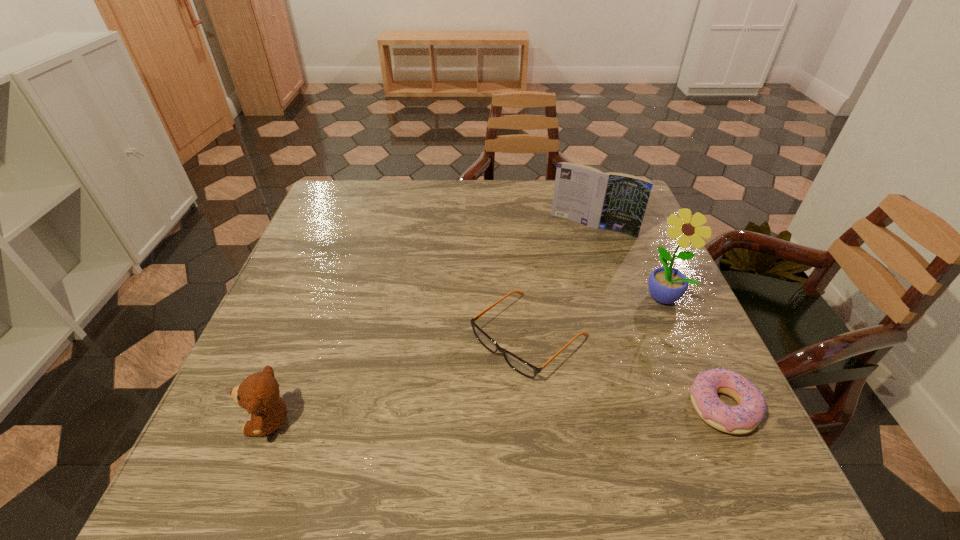
I want to click on vacant area at the left edge of the desktop, so click(x=331, y=340).

This screenshot has height=540, width=960. In the image, there is a desktop. Identify the location of free space at the right edge. (688, 337).

Where is `blank space at the far left corner of the desktop`? Image resolution: width=960 pixels, height=540 pixels. blank space at the far left corner of the desktop is located at coordinates (336, 188).

Find the location of a particular element. free space between the farthest object and the doughnut is located at coordinates [658, 316].

You are a GUI agent. You are given a task and a screenshot of the screen. Output one action in this format:
    pyautogui.click(x=<x>, y=<y>)
    Task: Click on the vacant area that lies between the sunflower and the teddy bear
    The width and height of the screenshot is (960, 540).
    Given the screenshot: What is the action you would take?
    click(x=467, y=359)

Where is `free space that is in between the doughnut and the tallest object`? free space that is in between the doughnut and the tallest object is located at coordinates (693, 351).

Where is `free space between the farthest object and the teddy bear`? This screenshot has height=540, width=960. free space between the farthest object and the teddy bear is located at coordinates (431, 323).

What are the coordinates of `vacant area that lies between the teddy bear and the farthest object` in the screenshot? It's located at (431, 323).

Where is `vacant point located between the doughnut and the third shortest object`? The width and height of the screenshot is (960, 540). vacant point located between the doughnut and the third shortest object is located at coordinates (496, 414).

Locate an element on the screen. free space between the third tallest object and the tallest object is located at coordinates (467, 359).